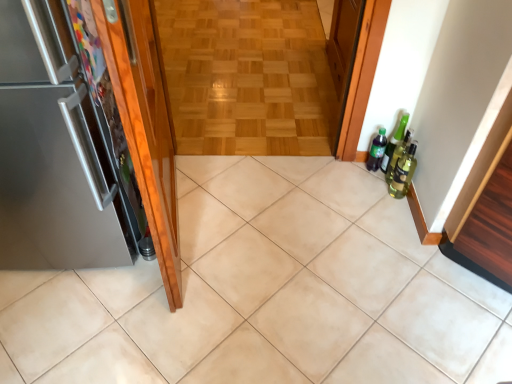
Locate an element on the screen. free location in front of green glass beer bottle at right, which is counted as the 2th beer bottle, starting from the front is located at coordinates (380, 196).